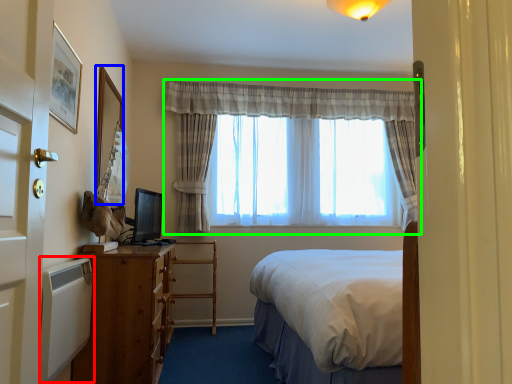
Question: Based on their relative distances, which object is farther from radiator (highlighted by a red box)? Choose from picture frame (highlighted by a blue box) and curtain (highlighted by a green box).

Choices:
 (A) picture frame
 (B) curtain

Answer: (B)